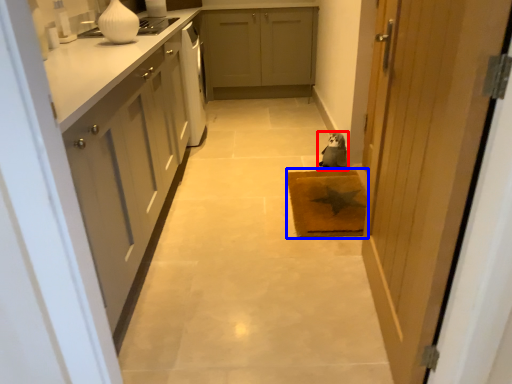
Question: Which object is closer to the camera taking this photo, animal (highlighted by a red box) or doormat (highlighted by a blue box)?

Choices:
 (A) animal
 (B) doormat

Answer: (B)